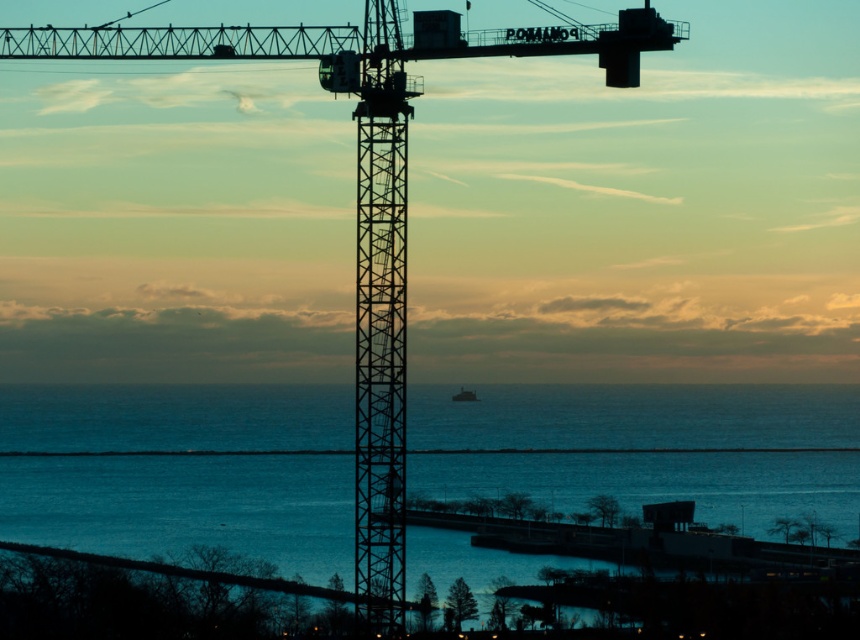
Is blue water at center wider than green matte boat at center?

Yes, blue water at center is wider than green matte boat at center.

I want to click on blue water at center, so click(647, 448).

Which is behind, point (791, 476) or point (459, 396)?

Point (791, 476)

Where is `blue water at center`? The image size is (860, 640). blue water at center is located at coordinates [x=647, y=448].